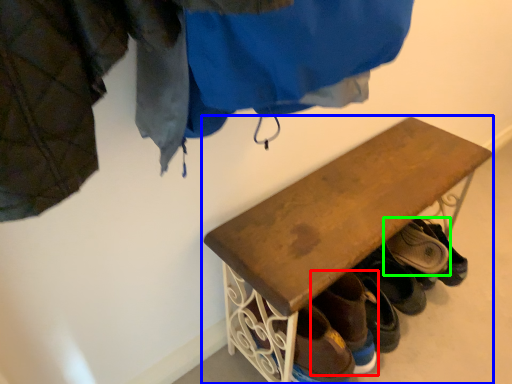
Question: Considering the real-world distances, which object is farthest from footwear (highlighted by a red box)? furniture (highlighted by a blue box) or footwear (highlighted by a green box)?

Choices:
 (A) furniture
 (B) footwear

Answer: (B)